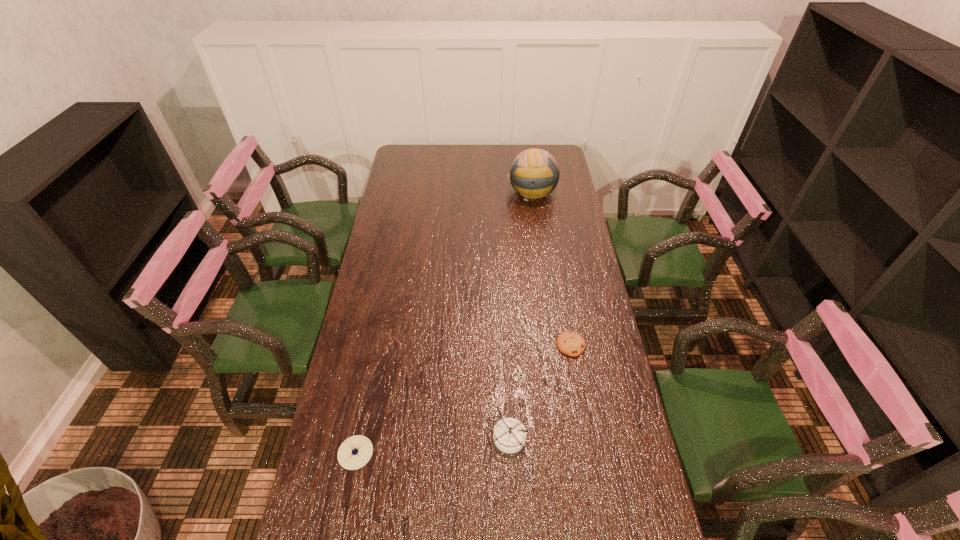
You are a GUI agent. You are given a task and a screenshot of the screen. Output one action in this format:
    pyautogui.click(x=<x>, y=<y>)
    Task: Click on the free region located 0.170m on the right of the second shortest object
    This screenshot has width=960, height=540.
    Given the screenshot: What is the action you would take?
    pyautogui.click(x=436, y=453)

Find the location of a particular element. This screenshot has width=960, height=540. vacant space located on the right of the cookie is located at coordinates (610, 345).

Find the location of a particular element. object at the left edge is located at coordinates (355, 452).

The image size is (960, 540). In order to click on volleyball that is at the right edge in this screenshot , I will do `click(534, 173)`.

The image size is (960, 540). I want to click on cookie located in the right edge section of the desktop, so click(x=570, y=343).

Locate an element on the screen. This screenshot has width=960, height=540. vacant area at the far edge is located at coordinates (443, 160).

Locate an element on the screen. This screenshot has width=960, height=540. vacant point at the left edge is located at coordinates 383,363.

Where is `vacant space at the right edge`? vacant space at the right edge is located at coordinates (588, 356).

This screenshot has width=960, height=540. In order to click on vacant space at the far left corner in this screenshot , I will do `click(420, 169)`.

This screenshot has height=540, width=960. I want to click on empty space between the cookie and the taller compass, so click(x=540, y=391).